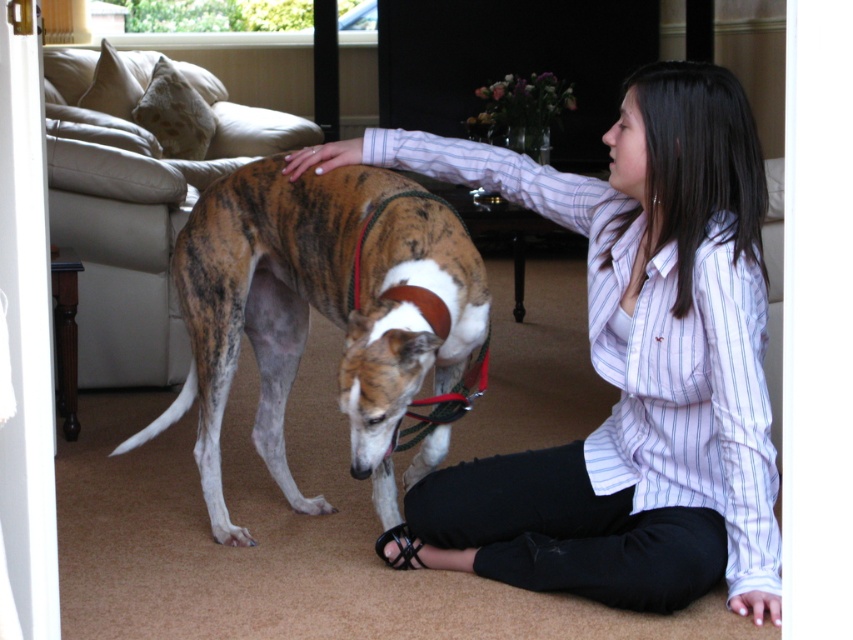
You are a photographer setting up a shoot in this room. You need to position a camera on a tripod so that both the matte striped shirt at center and the brindle fur dog at center are in frame. Given their heights, which object should be placed closer to the camera to ensure both are fully visible?

The brindle fur dog at center is shorter than the matte striped shirt at center. To ensure both are fully visible, the brindle fur dog at center should be placed closer to the camera so its entire body can be captured without being cut off by the frame.

You are a photographer setting up a shoot in this room. You want to position a light source so that it illuminates the matte striped shirt at center without shining directly on the brindle fur dog at center. Based on their positions, where should you place the light source relative to the two objects?

The matte striped shirt at center is located above the brindle fur dog at center. To illuminate the shirt without shining on the dog, place the light source above the shirt so that the light falls downward onto the shirt while avoiding the dog below.

You are a photographer setting up a photo shoot in this room. You need to position a light source so that it illuminates both the matte striped shirt at center and the brindle fur dog at center equally. Considering their sizes, which object should be placed closer to the light source?

The matte striped shirt at center has a smaller size compared to the brindle fur dog at center. To ensure both receive equal illumination, the smaller matte striped shirt at center should be placed closer to the light source so that both are adequately lit.